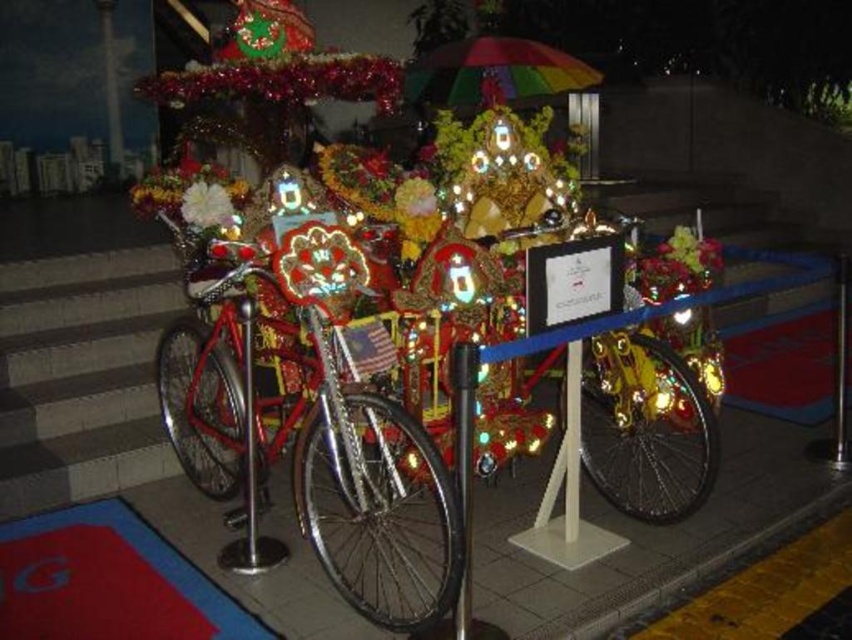
You are a tourist standing in front of the rickshaw and want to take a photo that includes both the shiny gold bicycle at center and the rainbow fabric umbrella at upper center. Which object should you position closer to the left side of your camera frame?

You should position the rainbow fabric umbrella at upper center closer to the left side of your camera frame because the shiny gold bicycle at center is to the right of it.

You are a delivery person who needs to load a package into the rickshaw. The package is 1 meter wide. You see the shiny metallic bicycle at center and the metallic silver pole at center. Which object has enough space to place the package next to it without overlapping?

The shiny metallic bicycle at center has a width larger than the metallic silver pole at center, so placing the package next to the shiny metallic bicycle at center would provide sufficient space since it is wider.

Looking at this image, you are a delivery person who needs to load a package onto the shiny metallic bicycle at center. The package is 1 meter in length. Can you place the package horizontally on the bicycle without it touching the metallic silver pole at center?

The shiny metallic bicycle at center is larger than the metallic silver pole at center, so yes, the package can be placed horizontally on the shiny metallic bicycle at center without touching the metallic silver pole at center.